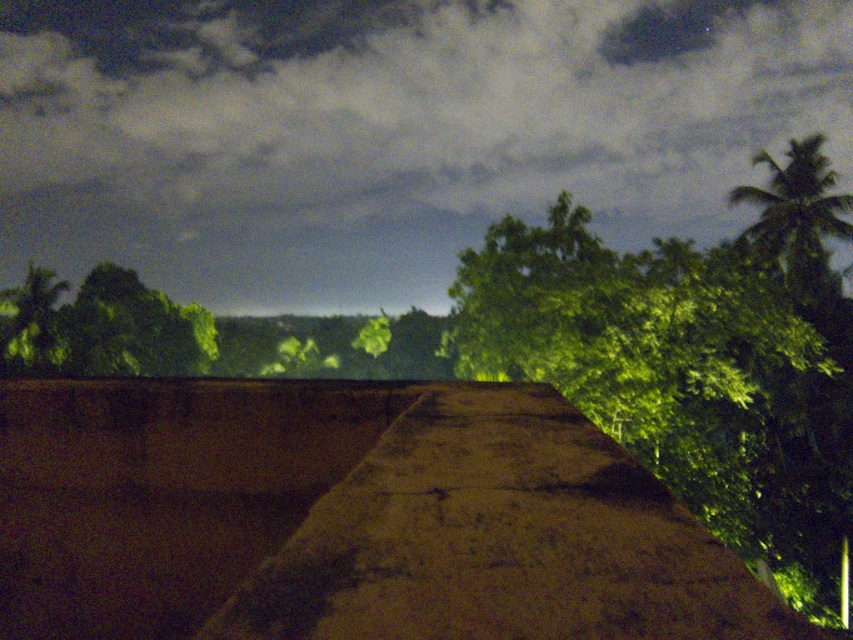
Question: Is dark cloudy sky at upper center above green leafy palm tree at upper right?

Choices:
 (A) no
 (B) yes

Answer: (B)

Question: Can you confirm if dark cloudy sky at upper center is positioned above green leafy palm tree at upper right?

Choices:
 (A) yes
 (B) no

Answer: (A)

Question: Which of the following is the farthest from the observer?

Choices:
 (A) (471, 90)
 (B) (808, 243)

Answer: (A)

Question: Which point is farther from the camera taking this photo?

Choices:
 (A) (766, 157)
 (B) (422, 204)

Answer: (B)

Question: Is dark cloudy sky at upper center wider than green leafy palm tree at upper right?

Choices:
 (A) no
 (B) yes

Answer: (B)